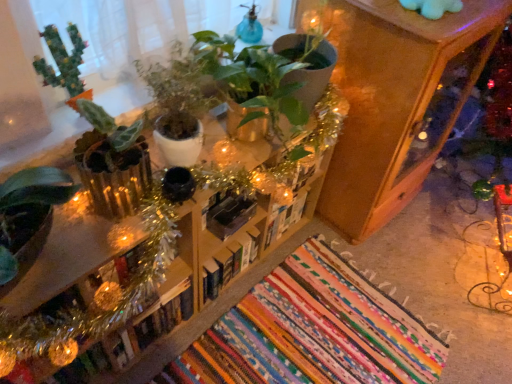
Locate an element on the screen. The width and height of the screenshot is (512, 384). free space between wooden cabinet at upper right and white matte book at center, acting as the 1th book starting from the right is located at coordinates (308, 246).